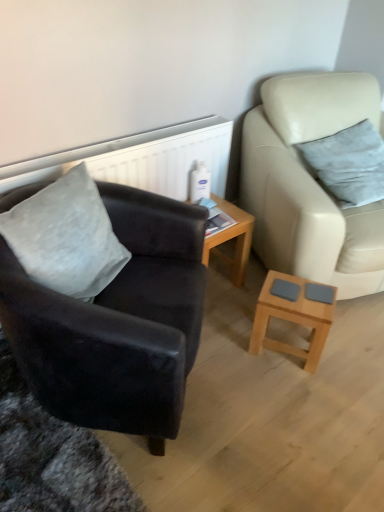
Question: In terms of height, does wooden table at center look taller or shorter compared to gray velvety pillow at left, arranged as the 1th pillow when viewed from the front?

Choices:
 (A) tall
 (B) short

Answer: (B)

Question: From a real-world perspective, is wooden table at center positioned above or below gray velvety pillow at left, the first pillow viewed from the left?

Choices:
 (A) below
 (B) above

Answer: (A)

Question: Based on their relative distances, which object is farther from the leather studio couch at right?

Choices:
 (A) gray velvety pillow at left, arranged as the 2th pillow when viewed from the right
 (B) velvety gray pillow at right, the 2th pillow from the front
 (C) wooden table at center
 (D) suede black armchair at left
 (E) light brown wooden coffee table at lower right

Answer: (A)

Question: Which object is the closest to the light brown wooden coffee table at lower right?

Choices:
 (A) leather studio couch at right
 (B) velvety gray pillow at right, which is the second pillow in left-to-right order
 (C) gray velvety pillow at left, the first pillow viewed from the left
 (D) wooden table at center
 (E) suede black armchair at left

Answer: (A)